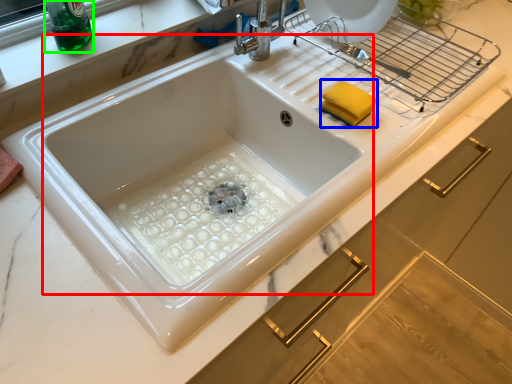
Question: Based on their relative distances, which object is nearer to sink (highlighted by a red box)? Choose from food (highlighted by a blue box) and beverage (highlighted by a green box).

Choices:
 (A) food
 (B) beverage

Answer: (A)